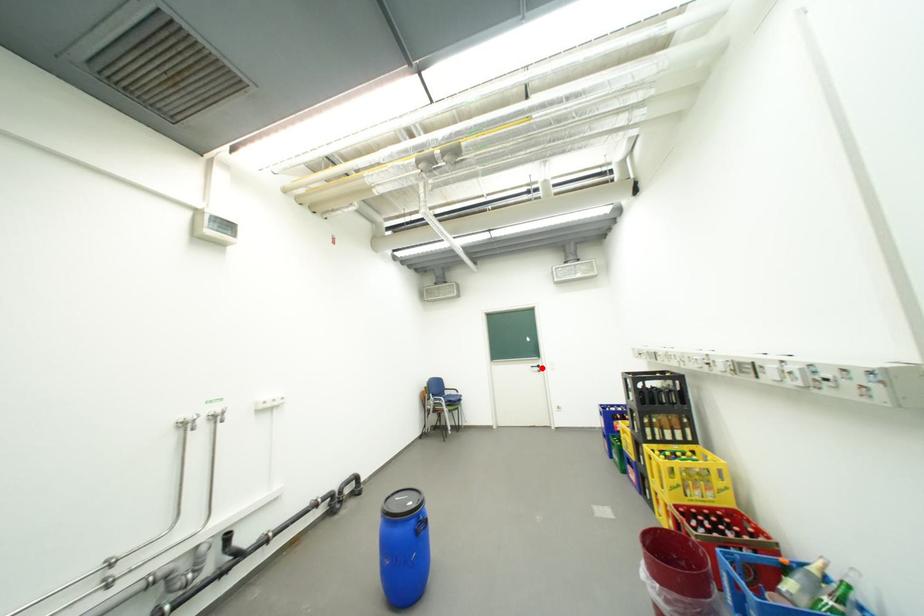
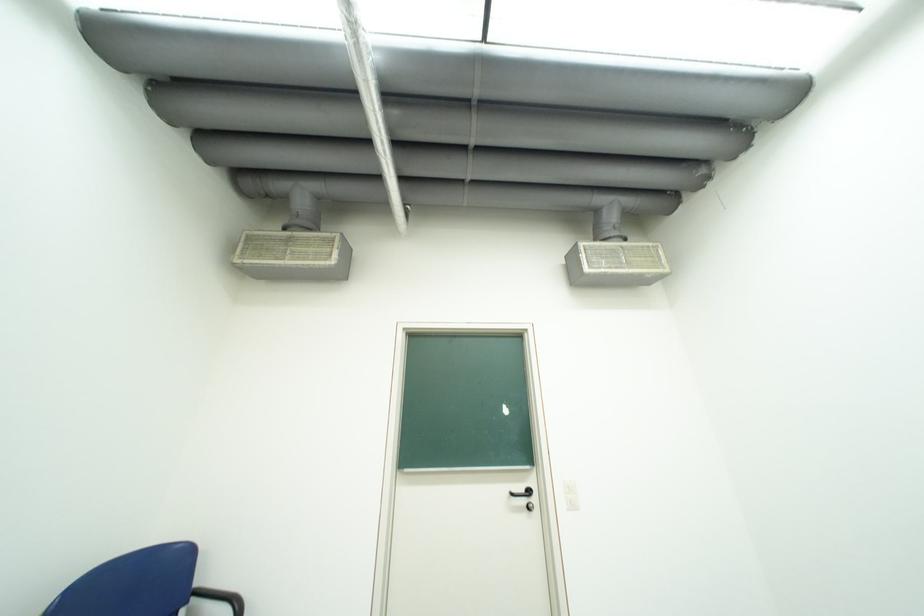
The point at the highlighted location is marked in the first image. Where is the corresponding point in the second image?

(523, 495)